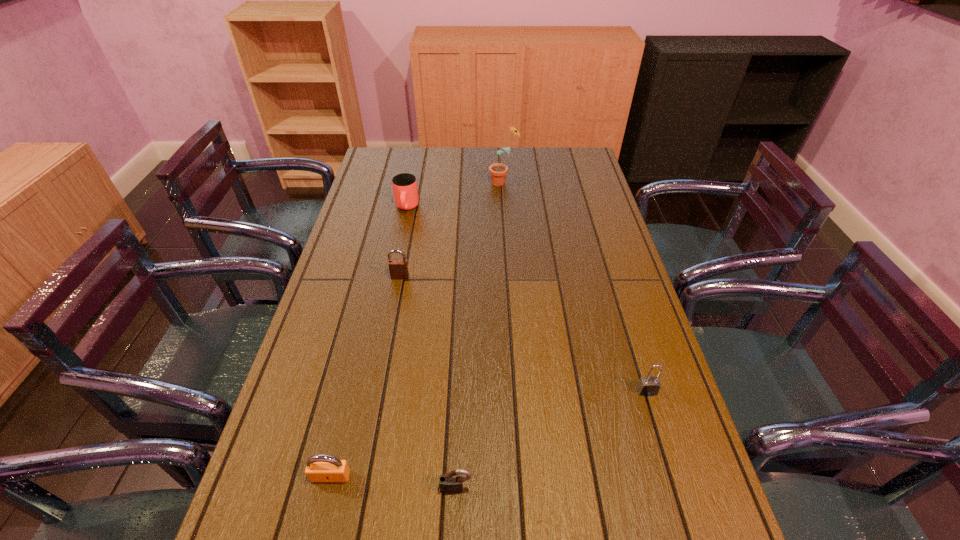
Where is `the fifth object from left to right`? the fifth object from left to right is located at coordinates (498, 171).

Identify the location of the tallest object. This screenshot has width=960, height=540. (498, 171).

I want to click on cup, so click(405, 190).

Where is `the farthest padlock`? the farthest padlock is located at coordinates [398, 268].

Where is `the rightmost object`? This screenshot has width=960, height=540. the rightmost object is located at coordinates (648, 386).

Locate an element on the screen. The image size is (960, 540). the fourth farthest object is located at coordinates click(x=648, y=386).

Identify the location of the third farthest padlock. The height and width of the screenshot is (540, 960). (319, 468).

Locate an element on the screen. the nearest padlock is located at coordinates (451, 482).

What are the coordinates of `the nearest object` in the screenshot? It's located at (451, 482).

The image size is (960, 540). What are the coordinates of `vacant space located on the flower of the second object from right to left` in the screenshot? It's located at [x=456, y=182].